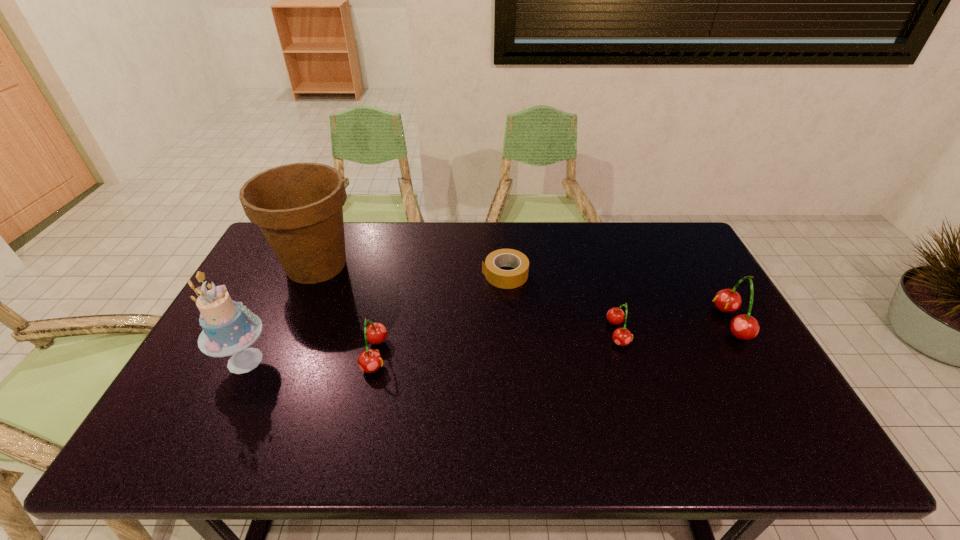
Please determine a free point for an extra cherry to ensure balance. Please provide its 2D coordinates. Your answer should be formatted as a tuple, i.e. [(x, y)], where the tuple contains the x and y coordinates of a point satisfying the conditions above.

[(499, 343)]